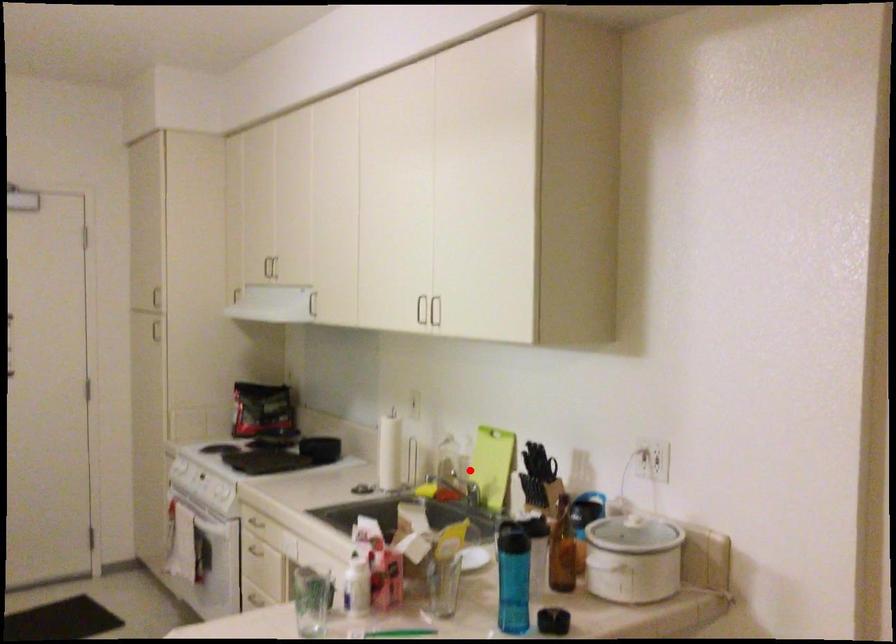
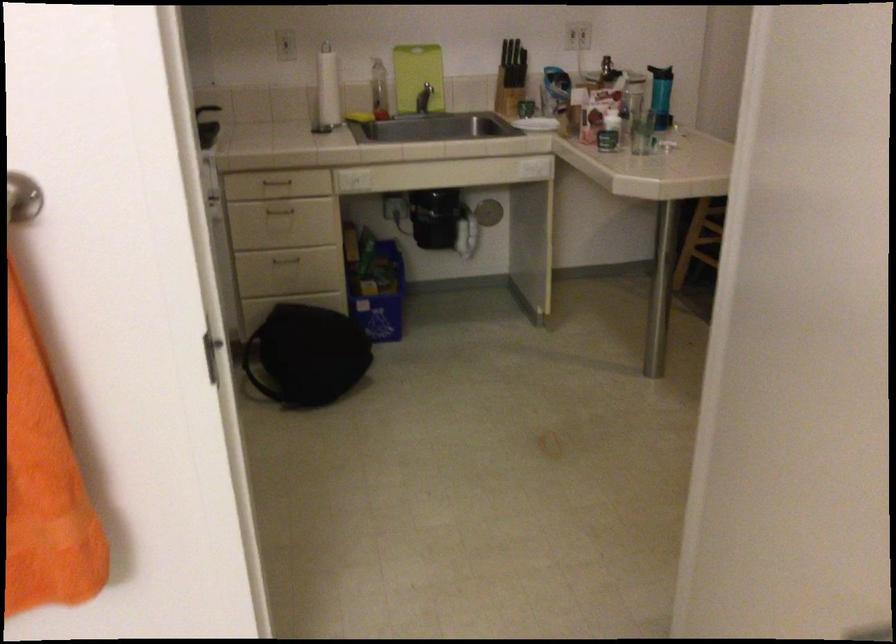
In the second image, find the point that corresponds to the highlighted location in the first image.

(378, 90)